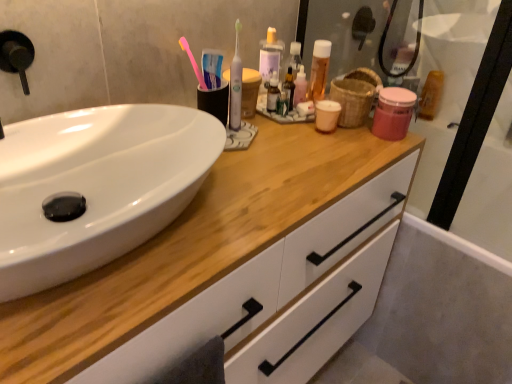
Describe the element at coordinates (192, 246) in the screenshot. I see `white matte cabinet at center` at that location.

Where is `bamboo basket at upper right`? The width and height of the screenshot is (512, 384). bamboo basket at upper right is located at coordinates (355, 95).

You are a GUI agent. You are given a task and a screenshot of the screen. Output one action in this format:
    pyautogui.click(x=<x>, y=<y>)
    Task: Click on the white glossy sink at left
    The height and width of the screenshot is (384, 512).
    Given the screenshot: What is the action you would take?
    pyautogui.click(x=96, y=186)

In terms of width, does black matte faucet at upper left look wider or thinner when compared to white glossy sink at left?

Considering their sizes, black matte faucet at upper left looks slimmer than white glossy sink at left.

How much distance is there between black matte faucet at upper left and white glossy sink at left?

They are 8.90 inches apart.

From a real-world perspective, which is physically below, black matte faucet at upper left or white glossy sink at left?

white glossy sink at left, from a real-world perspective.

Does black matte faucet at upper left lie in front of white glossy sink at left?

No, black matte faucet at upper left is further to the viewer.

From the image's perspective, which object appears higher, pink matte jar at upper right, the 3th mouthwash from the back, or white glossy sink at left?

pink matte jar at upper right, the 3th mouthwash from the back, from the image's perspective.

Is pink matte jar at upper right, placed as the second mouthwash when sorted from left to right, spatially inside white glossy sink at left, or outside of it?

pink matte jar at upper right, placed as the second mouthwash when sorted from left to right, exists outside the volume of white glossy sink at left.

Are pink matte jar at upper right, which is the 1th mouthwash in front-to-back order, and white glossy sink at left making contact?

No, pink matte jar at upper right, which is the 1th mouthwash in front-to-back order, is not next to white glossy sink at left.

Locate an element on the screen. mouthwash that is the 1st one when counting upward from the white glossy sink at left (from the image's perspective) is located at coordinates (393, 113).

Is white glossy toothbrush at center, which is counted as the 1th toothbrush, starting from the right, wider than translucent plastic mouthwash at center, the 2th mouthwash from the back?

No.

Locate an element on the screen. Image resolution: width=512 pixels, height=384 pixels. the 2nd toothbrush below the translucent plastic mouthwash at center, the third mouthwash viewed from the right (from the image's perspective) is located at coordinates (234, 85).

Between point (239, 74) and point (322, 45), which one is positioned in front?

Point (239, 74)

From a real-world perspective, is white glossy sink at left positioned over black matte faucet at upper left based on gravity?

No, from a real-world perspective, white glossy sink at left is not over black matte faucet at upper left

Does white glossy sink at left come in front of black matte faucet at upper left?

Yes, white glossy sink at left is closer to the camera.

From the image's perspective, is white glossy sink at left on top of black matte faucet at upper left?

No, from the image's perspective, white glossy sink at left is not on top of black matte faucet at upper left.

Is black matte faucet at upper left inside white glossy sink at left?

No, black matte faucet at upper left is located outside of white glossy sink at left.

From the picture: From a real-world perspective, who is located higher, white glossy sink at left or translucent plastic mouthwash at upper right, acting as the 3th mouthwash starting from the left?

In real-world perspective, white glossy sink at left is above.

Does white glossy sink at left touch translucent plastic mouthwash at upper right, the first mouthwash when ordered from back to front?

There is a gap between white glossy sink at left and translucent plastic mouthwash at upper right, the first mouthwash when ordered from back to front.

Between white glossy sink at left and translucent plastic mouthwash at upper right, acting as the 3th mouthwash starting from the left, which one has less height?

white glossy sink at left.

Considering the positions of point (130, 131) and point (436, 76), is point (130, 131) closer or farther from the camera than point (436, 76)?

Point (130, 131) appears to be closer to the viewer than point (436, 76).

Is translucent plastic mouthwash at center, the 2th mouthwash from the back, shorter than bamboo basket at upper right?

No, translucent plastic mouthwash at center, the 2th mouthwash from the back, is not shorter than bamboo basket at upper right.

From the picture: Between translucent plastic mouthwash at center, the third mouthwash viewed from the right, and bamboo basket at upper right, which one has larger size?

bamboo basket at upper right.

Is translucent plastic mouthwash at center, which appears as the 2th mouthwash when viewed from the front, completely or partially outside of bamboo basket at upper right?

Yes, translucent plastic mouthwash at center, which appears as the 2th mouthwash when viewed from the front, is outside of bamboo basket at upper right.

Which of these two, translucent plastic mouthwash at center, which is counted as the first mouthwash, starting from the left, or bamboo basket at upper right, is thinner?

translucent plastic mouthwash at center, which is counted as the first mouthwash, starting from the left.

Can pink plastic toothbrush at upper center, which is the 2th toothbrush from right to left, be found inside white matte cabinet at center?

No, white matte cabinet at center does not contain pink plastic toothbrush at upper center, which is the 2th toothbrush from right to left.

In terms of height, does white matte cabinet at center look taller or shorter compared to pink plastic toothbrush at upper center, which is the 2th toothbrush from right to left?

white matte cabinet at center is taller than pink plastic toothbrush at upper center, which is the 2th toothbrush from right to left.

I want to click on bathroom cabinet below the pink plastic toothbrush at upper center, which is the 2th toothbrush from right to left (from a real-world perspective), so click(192, 246).

At what (x,y) coordinates should I click in order to perform the action: click on faucet that appears on the left of white glossy sink at left. Please return your answer as a coordinate pair (x, y). Looking at the image, I should click on (16, 55).

Identify the location of sink that appears in front of the pink matte jar at upper right, placed as the second mouthwash when sorted from left to right. The height and width of the screenshot is (384, 512). (96, 186).

When comparing their distances from translucent plastic mouthwash at upper right, acting as the 3th mouthwash starting from the left, does white matte cabinet at center or white glossy toothbrush at center, acting as the 2th toothbrush starting from the left, seem further?

The object further to translucent plastic mouthwash at upper right, acting as the 3th mouthwash starting from the left, is white matte cabinet at center.

Based on their spatial positions, is black matte faucet at upper left or pink plastic toothbrush at upper center, the 1th toothbrush in the left-to-right sequence, further from pink matte jar at upper right, placed as the second mouthwash when sorted from left to right?

black matte faucet at upper left is further to pink matte jar at upper right, placed as the second mouthwash when sorted from left to right.

Based on their spatial positions, is white matte cabinet at center or translucent plastic mouthwash at upper right, the 3th mouthwash positioned from the front, further from black matte faucet at upper left?

translucent plastic mouthwash at upper right, the 3th mouthwash positioned from the front, is positioned further to the anchor black matte faucet at upper left.

Looking at the image, which one is located further to white matte cabinet at center, black matte faucet at upper left or bamboo basket at upper right?

Based on the image, black matte faucet at upper left appears to be further to white matte cabinet at center.

Based on their spatial positions, is bamboo basket at upper right or black matte faucet at upper left closer to white glossy sink at left?

The object closer to white glossy sink at left is black matte faucet at upper left.

Estimate the real-world distances between objects in this image. Which object is further from black matte faucet at upper left, pink matte jar at upper right, placed as the second mouthwash when sorted from left to right, or white glossy sink at left?

pink matte jar at upper right, placed as the second mouthwash when sorted from left to right, is further to black matte faucet at upper left.

Estimate the real-world distances between objects in this image. Which object is further from pink plastic toothbrush at upper center, which is the 2th toothbrush from right to left, black matte faucet at upper left or translucent plastic mouthwash at center, the 2th mouthwash from the back?

Among the two, black matte faucet at upper left is located further to pink plastic toothbrush at upper center, which is the 2th toothbrush from right to left.

Estimate the real-world distances between objects in this image. Which object is further from bamboo basket at upper right, white matte cabinet at center or white glossy toothbrush at center, which is counted as the 1th toothbrush, starting from the right?

Based on the image, white matte cabinet at center appears to be further to bamboo basket at upper right.

At what (x,y) coordinates should I click in order to perform the action: click on mouthwash located between bamboo basket at upper right and translucent plastic mouthwash at upper right, the first mouthwash when ordered from back to front, in the depth direction. Please return your answer as a coordinate pair (x, y). Looking at the image, I should click on (319, 69).

This screenshot has width=512, height=384. I want to click on basket between pink plastic toothbrush at upper center, the 1th toothbrush in the left-to-right sequence, and white matte cabinet at center, in the vertical direction, so click(355, 95).

This screenshot has width=512, height=384. In order to click on bathroom cabinet positioned between white glossy sink at left and bamboo basket at upper right from near to far in this screenshot , I will do `click(192, 246)`.

Where is `bathroom cabinet between white glossy sink at left and translucent plastic mouthwash at upper right, the first mouthwash when ordered from back to front, in the front-back direction`? The width and height of the screenshot is (512, 384). bathroom cabinet between white glossy sink at left and translucent plastic mouthwash at upper right, the first mouthwash when ordered from back to front, in the front-back direction is located at coordinates (192, 246).